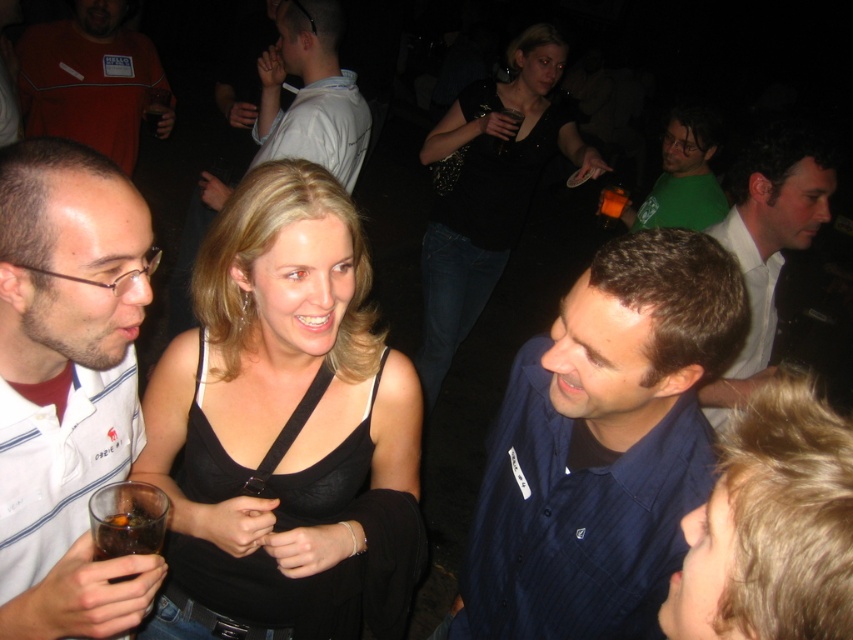
Can you confirm if black matte tank top at center is smaller than black satin dress at center?

Indeed, black matte tank top at center has a smaller size compared to black satin dress at center.

Where is `black matte tank top at center`? black matte tank top at center is located at coordinates (287, 422).

In the scene shown: Which of these two, black matte tank top at center or black fabric dress at center, stands shorter?

With less height is black fabric dress at center.

Can you confirm if black matte tank top at center is positioned below black fabric dress at center?

Yes, black matte tank top at center is below black fabric dress at center.

Which is in front, point (335, 259) or point (822, 545)?

Point (822, 545)

Locate an element on the screen. Image resolution: width=853 pixels, height=640 pixels. black matte tank top at center is located at coordinates point(287,422).

Which is more to the right, black fabric dress at center or black satin dress at center?

From the viewer's perspective, black fabric dress at center appears more on the right side.

Between point (728, 461) and point (502, 221), which one is positioned in front?

Point (728, 461)

Which is behind, point (776, 428) or point (431, 388)?

The point (431, 388) is behind.

Where is `black fabric dress at center`? black fabric dress at center is located at coordinates (770, 528).